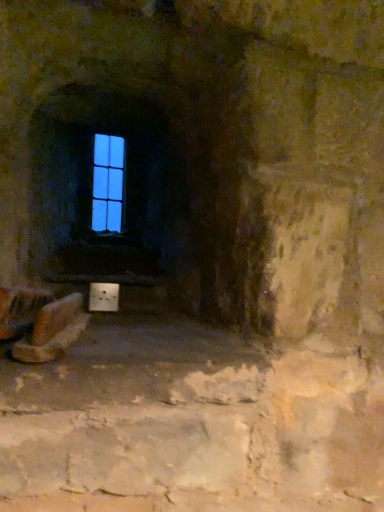
The image size is (384, 512). Describe the element at coordinates (107, 183) in the screenshot. I see `blue glass window at center` at that location.

At what (x,y) coordinates should I click in order to perform the action: click on blue glass window at center. Please return your answer as a coordinate pair (x, y). This screenshot has width=384, height=512. Looking at the image, I should click on [107, 183].

What is the approximate width of blue glass window at center?

The width of blue glass window at center is 1.17 inches.

At what (x,y) coordinates should I click in order to perform the action: click on blue glass window at center. Please return your answer as a coordinate pair (x, y). This screenshot has height=512, width=384. Looking at the image, I should click on (107, 183).